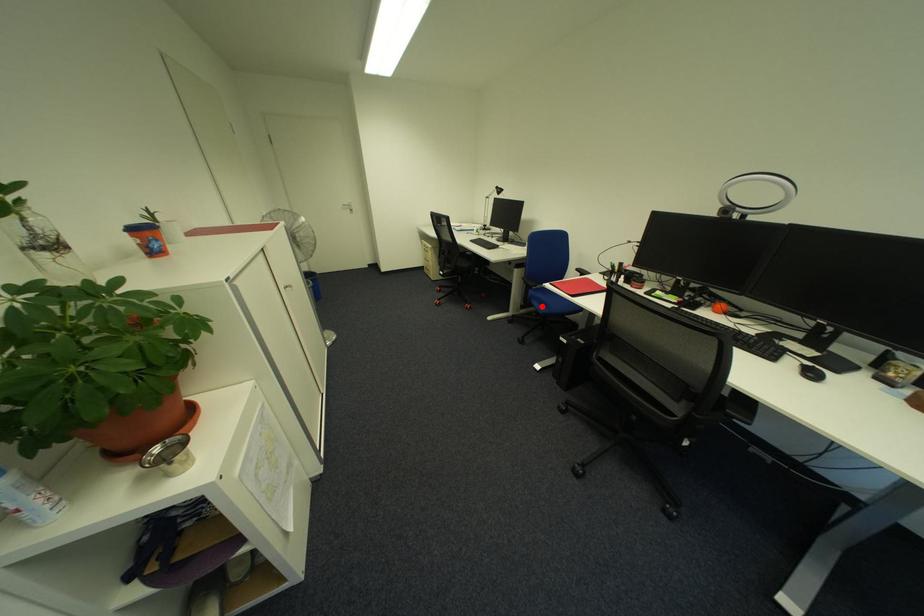
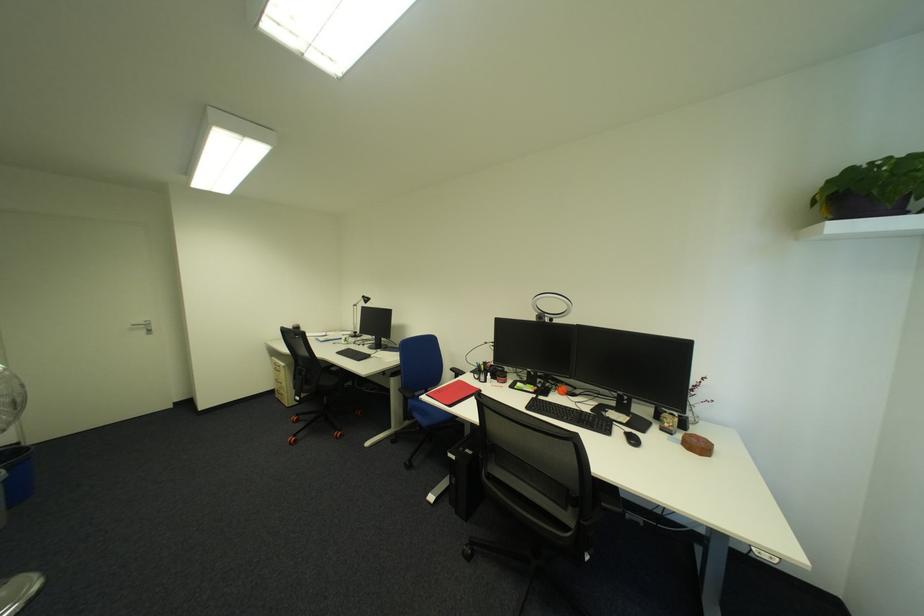
Question: I am providing you with two images of the same scene from different viewpoints. Given a red point in image1, look at the same physical point in image2. Is it:

Choices:
 (A) Closer to the viewpoint
 (B) Farther from the viewpoint

Answer: (B)